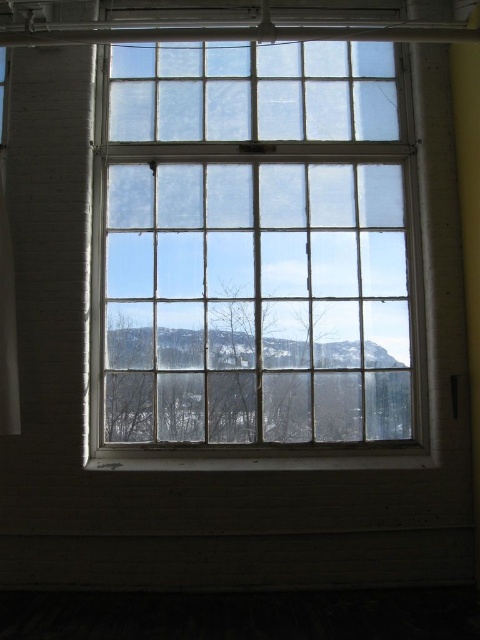
Consider the image. You are standing in a room with a clear glass window at center and a white sheer curtain at left. Which object is closer to you?

The clear glass window at center is closer to you than the white sheer curtain at left.

You are standing in a room with a clear glass window at center. If you want to look outside through the window, where should you position yourself relative to the window?

The clear glass window at center is located at point (254, 253), so you should position yourself in front of the clear glass window at center to look outside through it.

You are standing in a room with a large window. You notice a point at coordinates (254, 253). What object is located at this point?

The clear glass window at center is located at point (254, 253).